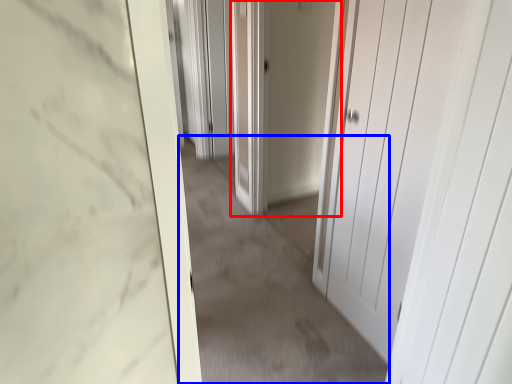
Question: Which object appears closest to the camera in this image, door (highlighted by a red box) or plain (highlighted by a blue box)?

Choices:
 (A) door
 (B) plain

Answer: (B)